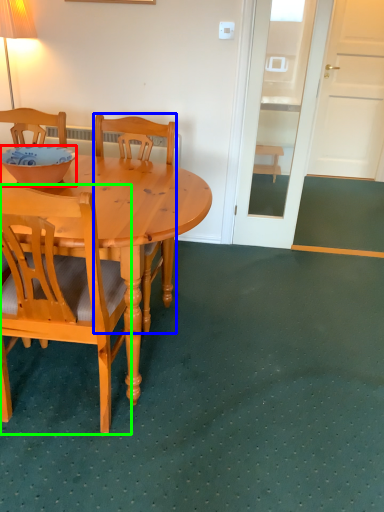
Question: Considering the real-world distances, which object is farthest from bowl (highlighted by a red box)? chair (highlighted by a blue box) or chair (highlighted by a green box)?

Choices:
 (A) chair
 (B) chair

Answer: (B)